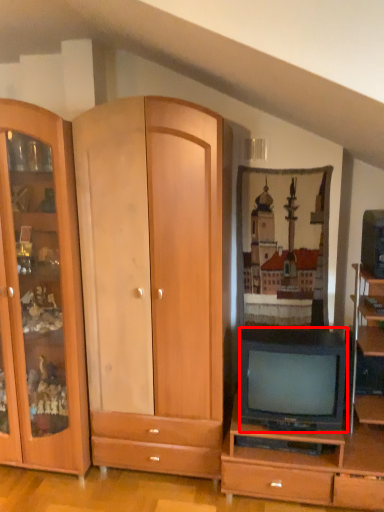
Question: From the image, what is the correct spatial relationship of television (annotated by the red box) in relation to television?

Choices:
 (A) right
 (B) left

Answer: (B)